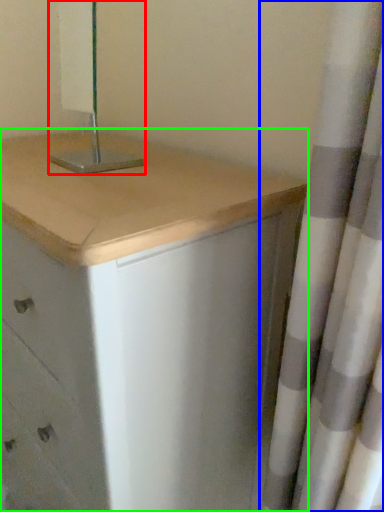
Question: Based on their relative distances, which object is nearer to bedside lamp (highlighted by a red box)? Choose from curtain (highlighted by a blue box) and chest of drawers (highlighted by a green box).

Choices:
 (A) curtain
 (B) chest of drawers

Answer: (B)